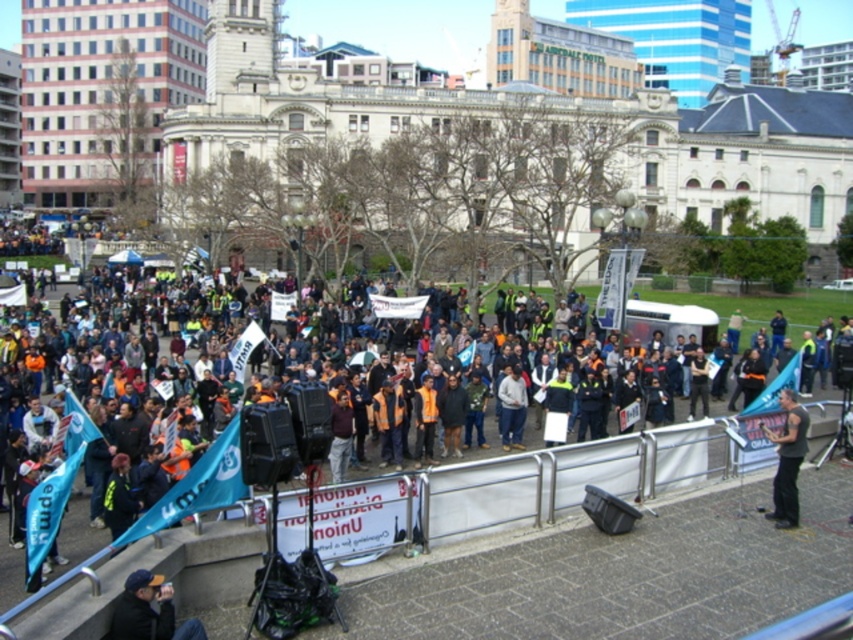
Can you confirm if dark blue knit cap at lower left is wider than black fabric shirt at lower right?

No, dark blue knit cap at lower left is not wider than black fabric shirt at lower right.

Does dark blue knit cap at lower left have a lesser width compared to black fabric shirt at lower right?

Yes, dark blue knit cap at lower left is thinner than black fabric shirt at lower right.

Measure the distance between point [141,572] and camera.

A distance of 40.69 meters exists between point [141,572] and camera.

This screenshot has height=640, width=853. I want to click on dark blue knit cap at lower left, so pyautogui.click(x=149, y=611).